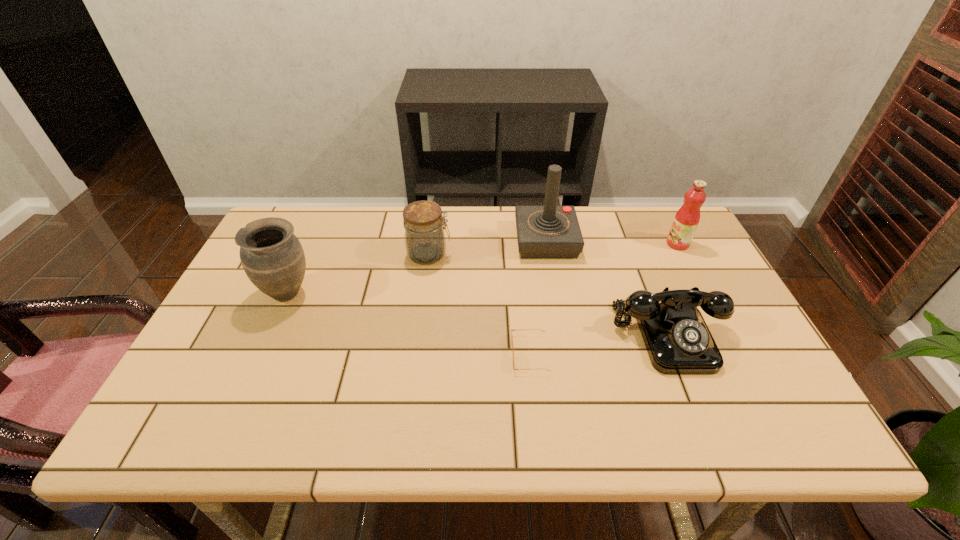
Where is `free point that satisfies the following two spatial constraints: 1. on the front label of the fruit juice; 2. on the dial of the fifth tallest object`? free point that satisfies the following two spatial constraints: 1. on the front label of the fruit juice; 2. on the dial of the fifth tallest object is located at coordinates (726, 336).